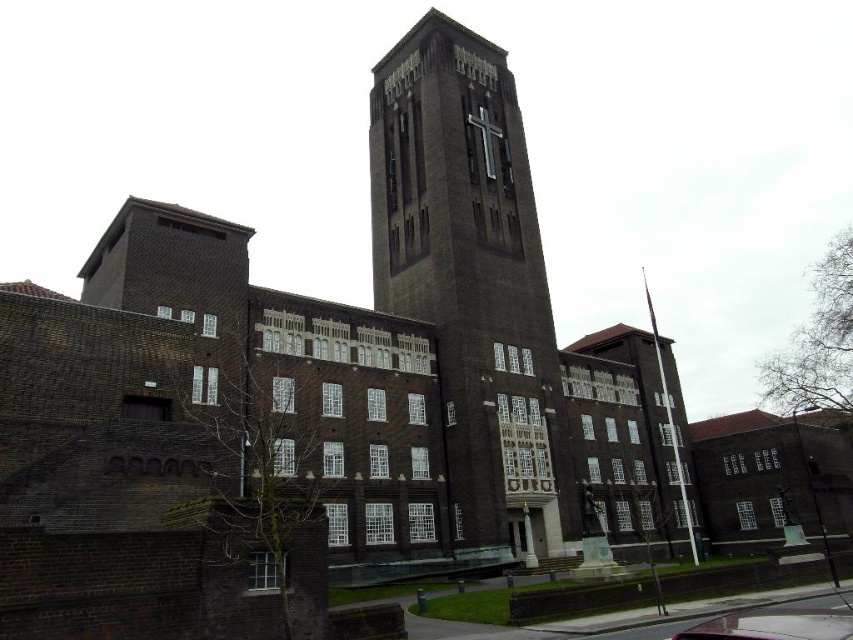
Who is more distant from viewer, (445, 154) or (842, 632)?

The point (445, 154) is behind.

Is brown brick tower at center shorter than metallic pink car at lower center?

No, brown brick tower at center is not shorter than metallic pink car at lower center.

Locate an element on the screen. The image size is (853, 640). brown brick tower at center is located at coordinates (469, 269).